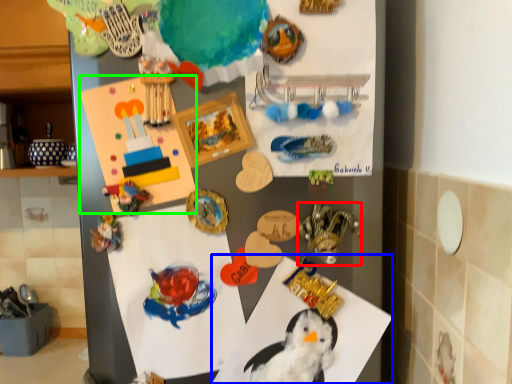
Question: Which object is the farthest from toy (highlighted by a red box)? Choose among these: paper (highlighted by a blue box) or postcard (highlighted by a green box).

Choices:
 (A) paper
 (B) postcard

Answer: (B)